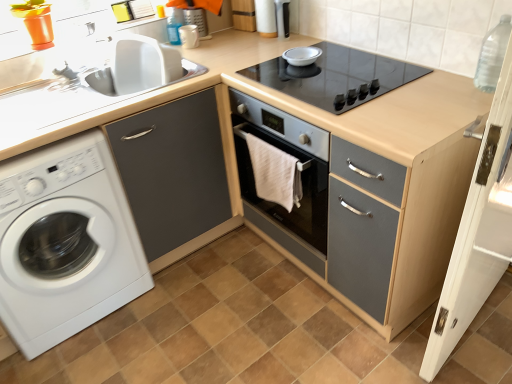
Where is `free space to the back side of transparent plastic bottle at upper right`? The height and width of the screenshot is (384, 512). free space to the back side of transparent plastic bottle at upper right is located at coordinates (458, 79).